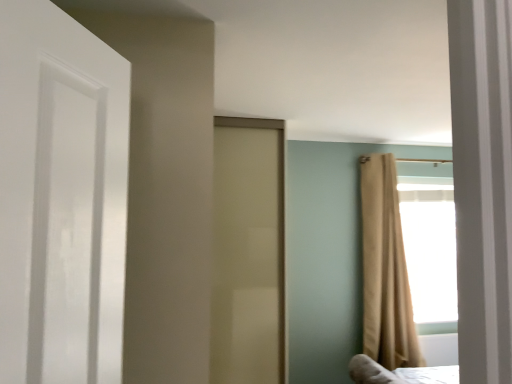
Question: Is beige fabric curtain at right taller than matte beige door at center?

Choices:
 (A) yes
 (B) no

Answer: (B)

Question: Does beige fabric curtain at right contain matte beige door at center?

Choices:
 (A) no
 (B) yes

Answer: (A)

Question: Can you confirm if beige fabric curtain at right is shorter than matte beige door at center?

Choices:
 (A) yes
 (B) no

Answer: (A)

Question: From the image's perspective, is beige fabric curtain at right on matte beige door at center?

Choices:
 (A) yes
 (B) no

Answer: (B)

Question: Is beige fabric curtain at right positioned before matte beige door at center?

Choices:
 (A) yes
 (B) no

Answer: (B)

Question: Are beige fabric curtain at right and matte beige door at center far apart?

Choices:
 (A) yes
 (B) no

Answer: (A)

Question: Could you tell me if matte beige door at center is facing beige fabric curtain at right?

Choices:
 (A) yes
 (B) no

Answer: (B)

Question: Does matte beige door at center have a greater height compared to beige fabric curtain at right?

Choices:
 (A) no
 (B) yes

Answer: (B)

Question: Is matte beige door at center facing away from beige fabric curtain at right?

Choices:
 (A) no
 (B) yes

Answer: (A)

Question: Is beige fabric curtain at right inside matte beige door at center?

Choices:
 (A) no
 (B) yes

Answer: (A)

Question: Can you confirm if matte beige door at center is thinner than beige fabric curtain at right?

Choices:
 (A) yes
 (B) no

Answer: (B)

Question: From the image's perspective, is matte beige door at center over beige fabric curtain at right?

Choices:
 (A) yes
 (B) no

Answer: (A)

Question: Is beige fabric curtain at right to the left or to the right of matte beige door at center in the image?

Choices:
 (A) right
 (B) left

Answer: (A)